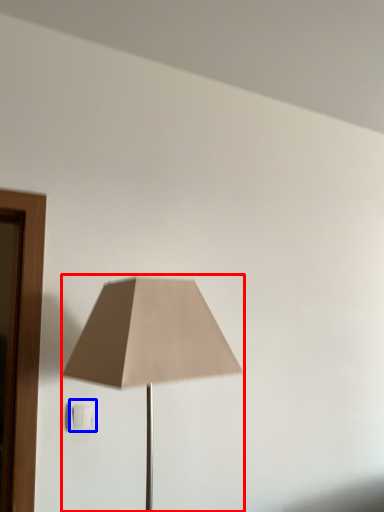
Question: Which point is closer to the camera, lamp (highlighted by a red box) or electric outlet (highlighted by a blue box)?

Choices:
 (A) lamp
 (B) electric outlet

Answer: (A)